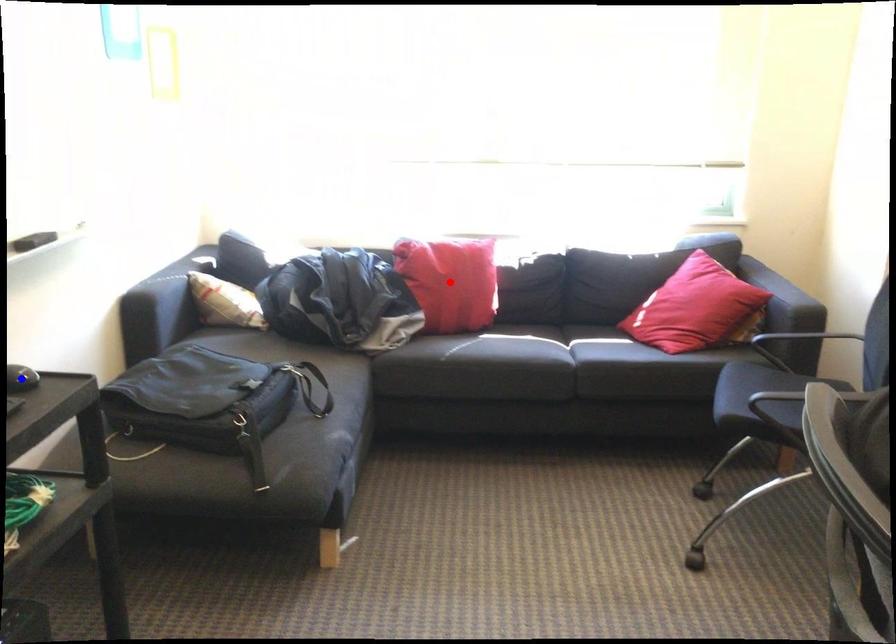
Question: Two points are marked on the image. Which point is closer to the camera?

Choices:
 (A) Blue point is closer.
 (B) Red point is closer.

Answer: (A)